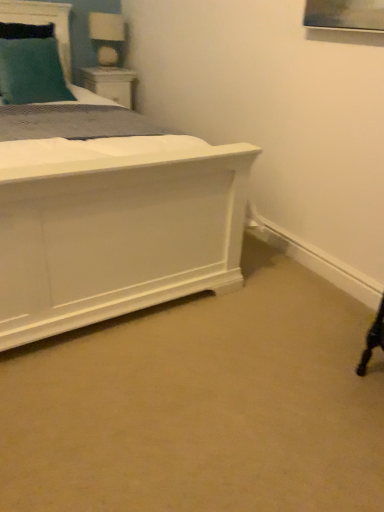
Question: Is teal fabric pillow at upper left a part of white glossy table lamp at upper left?

Choices:
 (A) yes
 (B) no

Answer: (B)

Question: Can you confirm if white glossy table lamp at upper left is positioned to the left of teal fabric pillow at upper left?

Choices:
 (A) no
 (B) yes

Answer: (A)

Question: Is white glossy table lamp at upper left not inside teal fabric pillow at upper left?

Choices:
 (A) no
 (B) yes

Answer: (B)

Question: Does white glossy table lamp at upper left have a lesser width compared to teal fabric pillow at upper left?

Choices:
 (A) yes
 (B) no

Answer: (A)

Question: Is white glossy table lamp at upper left far from teal fabric pillow at upper left?

Choices:
 (A) yes
 (B) no

Answer: (B)

Question: Is white glossy table lamp at upper left at the right side of teal fabric pillow at upper left?

Choices:
 (A) no
 (B) yes

Answer: (B)

Question: From a real-world perspective, does teal fabric pillow at upper left stand above teal fabric headboard at upper left?

Choices:
 (A) no
 (B) yes

Answer: (A)

Question: Could you tell me if teal fabric pillow at upper left is facing teal fabric headboard at upper left?

Choices:
 (A) yes
 (B) no

Answer: (B)

Question: Does teal fabric pillow at upper left have a lesser height compared to teal fabric headboard at upper left?

Choices:
 (A) yes
 (B) no

Answer: (B)

Question: Is teal fabric pillow at upper left not close to teal fabric headboard at upper left?

Choices:
 (A) yes
 (B) no

Answer: (B)

Question: Considering the relative positions of teal fabric pillow at upper left and teal fabric headboard at upper left in the image provided, is teal fabric pillow at upper left to the left of teal fabric headboard at upper left from the viewer's perspective?

Choices:
 (A) yes
 (B) no

Answer: (B)

Question: Can you confirm if teal fabric pillow at upper left is positioned to the right of teal fabric headboard at upper left?

Choices:
 (A) yes
 (B) no

Answer: (A)

Question: Is teal fabric headboard at upper left to the left of white wood nightstand at upper left from the viewer's perspective?

Choices:
 (A) yes
 (B) no

Answer: (A)